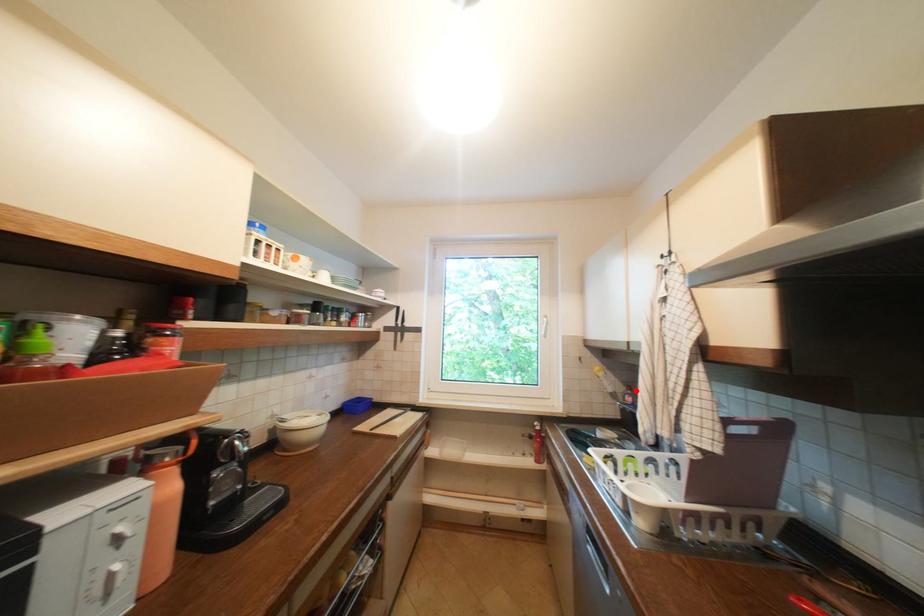
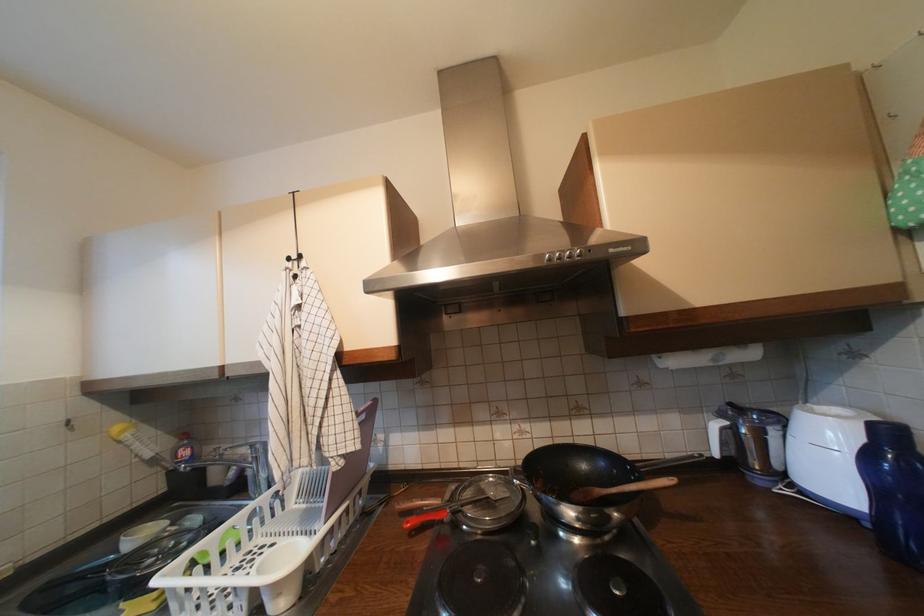
Locate, in the second image, the point that corresponds to the highlighted location in the first image.

(189, 440)